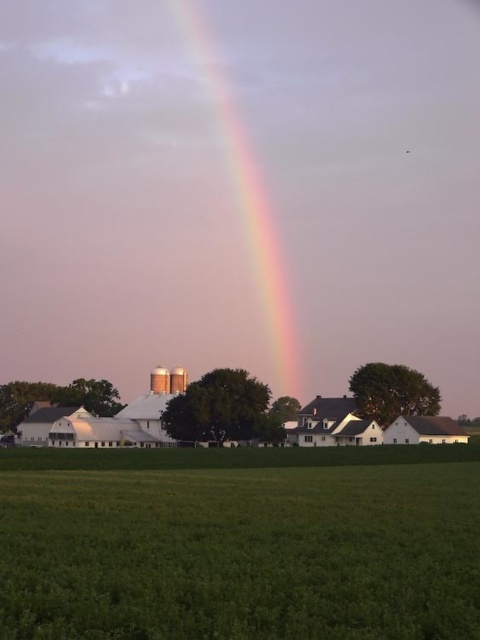
What is located at the coordinates point (240, 544) in the image?

The point (240, 544) is where the green grass at lower center is located.

You are standing in the middle of the green grass at lower center and want to walk towards the rainbow at center. Which direction should you move?

The green grass at lower center is to the right of rainbow at center, so you should move to the left to reach the rainbow at center.